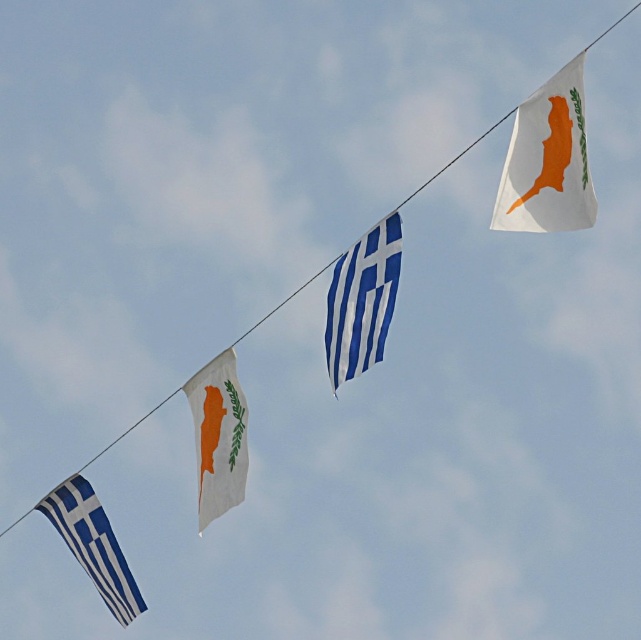
Can you confirm if white matte flag at upper right is positioned to the right of white fabric flag at center?

Correct, you'll find white matte flag at upper right to the right of white fabric flag at center.

Does point (535, 97) come farther from viewer compared to point (231, 364)?

No, it is not.

Does point (529, 115) come closer to viewer compared to point (226, 484)?

That is True.

This screenshot has width=641, height=640. What are the coordinates of `white matte flag at upper right` in the screenshot? It's located at (547, 161).

Who is lower down, blue/white striped flag at center or white fabric flag at center?

white fabric flag at center is below.

Can you confirm if blue/white striped flag at center is positioned below white fabric flag at center?

No, blue/white striped flag at center is not below white fabric flag at center.

Is point (342, 257) less distant than point (221, 502)?

Yes, it is in front of point (221, 502).

This screenshot has height=640, width=641. I want to click on blue/white striped flag at center, so click(362, 301).

Based on the photo, does white matte flag at upper right have a greater height compared to blue/white striped flag at lower left?

Incorrect, white matte flag at upper right's height is not larger of blue/white striped flag at lower left's.

Is point (537, 182) less distant than point (117, 580)?

Yes, point (537, 182) is closer to viewer.

Find the location of `white matte flag at upper right`. white matte flag at upper right is located at coordinates (547, 161).

This screenshot has width=641, height=640. In order to click on white matte flag at upper right in this screenshot , I will do `click(547, 161)`.